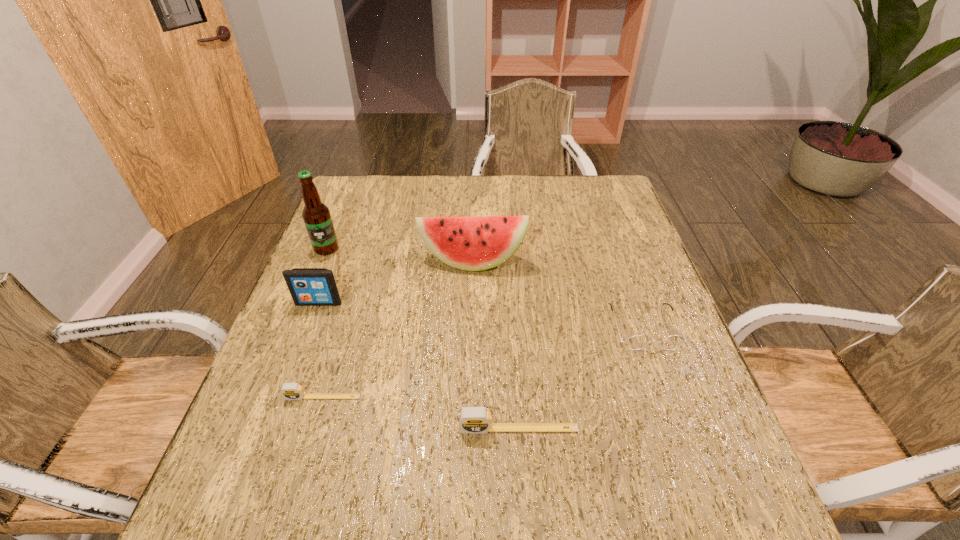
You are a GUI agent. You are given a task and a screenshot of the screen. Output one action in this format:
    pyautogui.click(x=<x>, y=<y>)
    Task: Click on the vacant space that's between the right tape measure and the tallest object
    
    Given the screenshot: What is the action you would take?
    pyautogui.click(x=422, y=339)

Locate an element on the screen. This screenshot has width=960, height=540. vacant space that is in between the second shortest object and the left tape measure is located at coordinates (483, 362).

The height and width of the screenshot is (540, 960). Identify the location of unoccupied position between the nearest object and the rightmost object. (581, 378).

Identify which object is located as the fourth nearest to the shortest object. Please provide its 2D coordinates. Your answer should be formatted as a tuple, i.e. [(x, y)], where the tuple contains the x and y coordinates of a point satisfying the conditions above.

[(316, 215)]

Select which object appears as the second closest to the third tallest object. Please provide its 2D coordinates. Your answer should be formatted as a tuple, i.e. [(x, y)], where the tuple contains the x and y coordinates of a point satisfying the conditions above.

[(474, 243)]